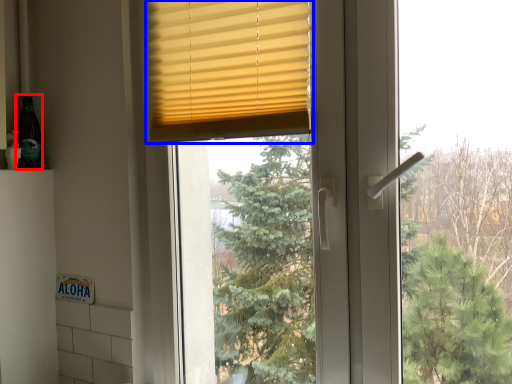
Question: Which object appears closest to the camera in this image, bottle (highlighted by a red box) or window blind (highlighted by a blue box)?

Choices:
 (A) bottle
 (B) window blind

Answer: (B)